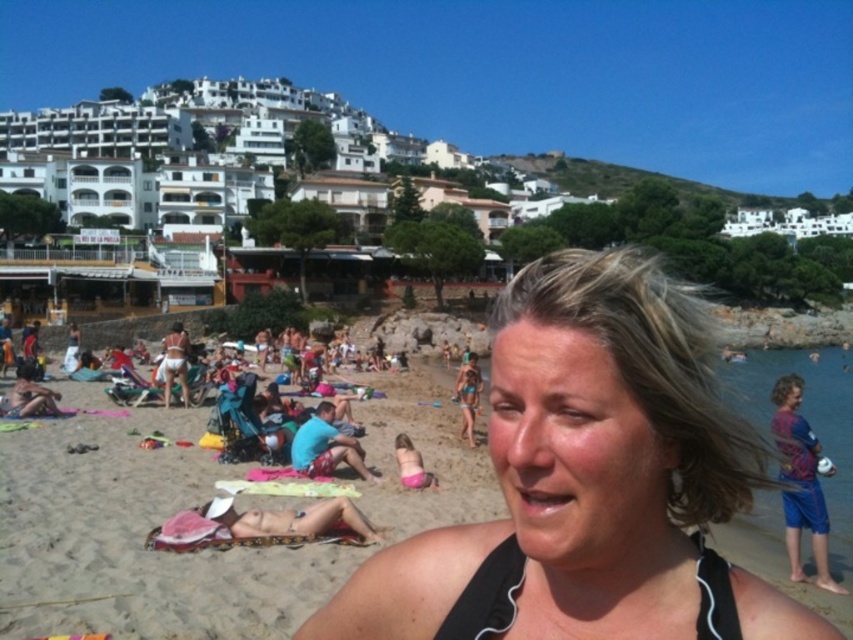
Looking at this image, you are standing on the beach and want to walk to both the point at coordinates point (505, 604) and point (809, 476). Which point should you reach first to minimize your walking distance?

You should reach point (505, 604) first because it is closer to the viewer than point (809, 476), so it requires less walking distance.

You are a photographer standing at the beach scene. You want to take a photo that includes both the black swimsuit at center and the black fabric bikini top at lower center. The minimum distance between them is 13.22 feet. Can you fit both in the frame of your camera that has a 10 feet field of view?

The black swimsuit at center is 13.22 feet away from the black fabric bikini top at lower center. Since the camera has a 10 feet field of view, which is shorter than the distance between them, you cannot fit both in the frame.

You are a photographer at the beach and want to capture a candid shot of the woman without showing her lower body. Given the positions of the black fabric bikini top at lower center and the blue fabric shorts at right, can you determine if the shorts will be visible in the shot?

The black fabric bikini top at lower center is shorter than the blue fabric shorts at right, meaning the shorts extend lower. Since the shorts are longer, they are more likely to be visible in the shot, so the photographer should adjust the framing to avoid showing the lower body.